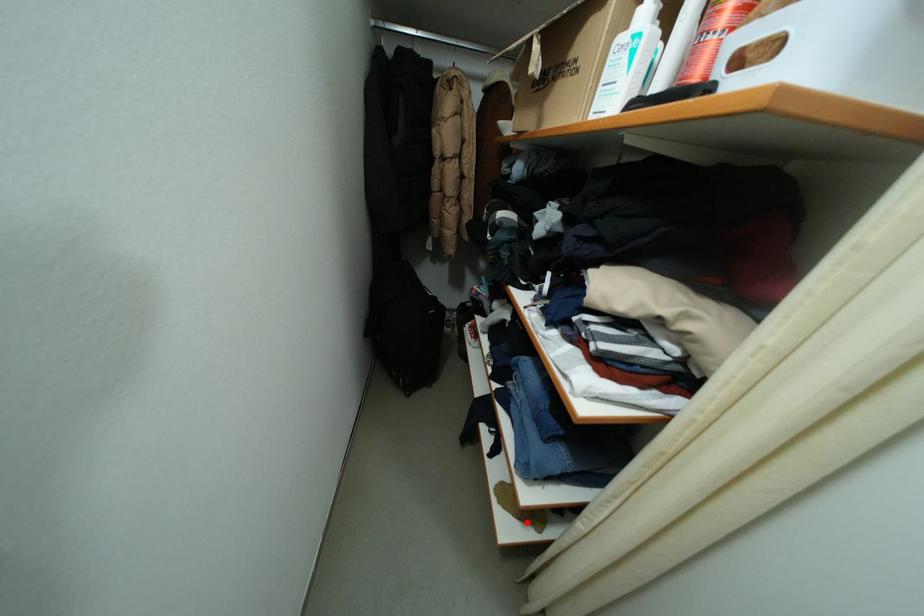
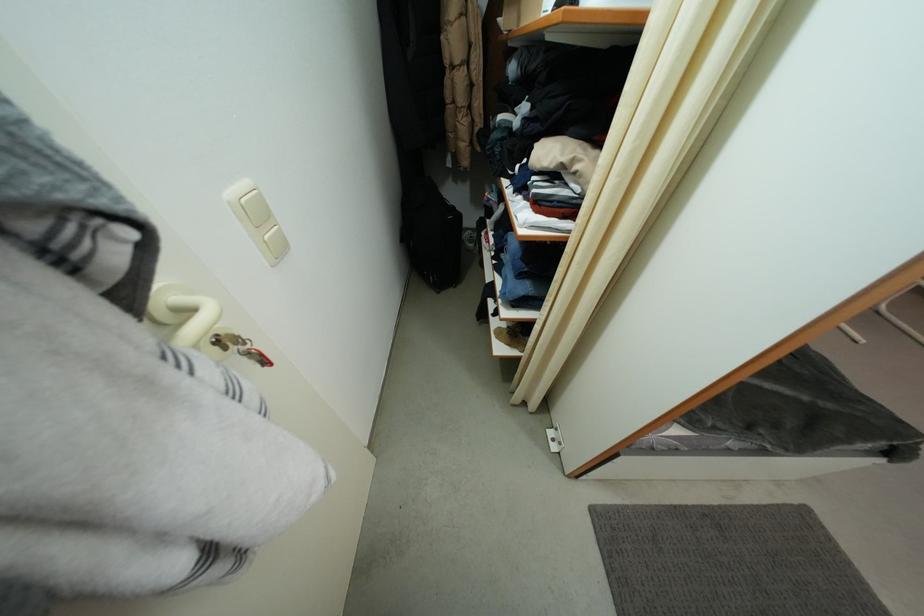
Question: A red point is marked in image1. In image2, is the corresponding 3D point closer to the camera or farther? Reply with the corresponding letter.

Choices:
 (A) The corresponding 3D point is closer.
 (B) The corresponding 3D point is farther.

Answer: (A)